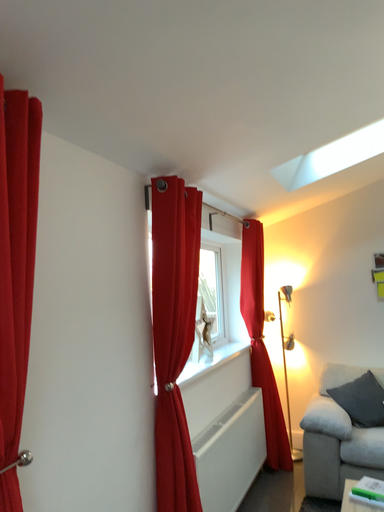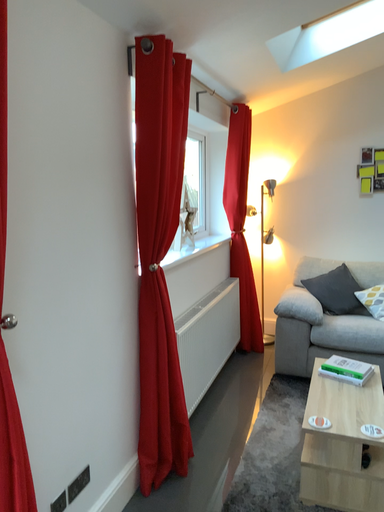
Question: How did the camera likely rotate when shooting the video?

Choices:
 (A) rotated downward
 (B) rotated upward

Answer: (A)